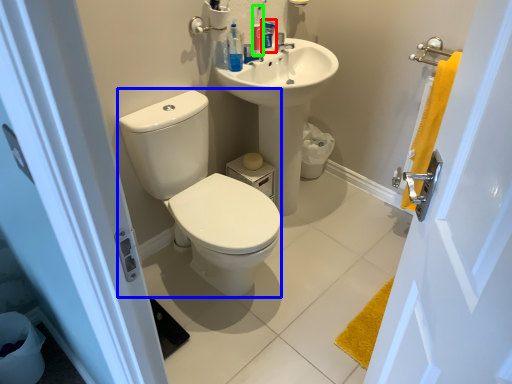
Question: Which is nearer to the mouthwash (highlighted by a red box)? sit (highlighted by a blue box) or toiletry (highlighted by a green box).

Choices:
 (A) sit
 (B) toiletry

Answer: (B)